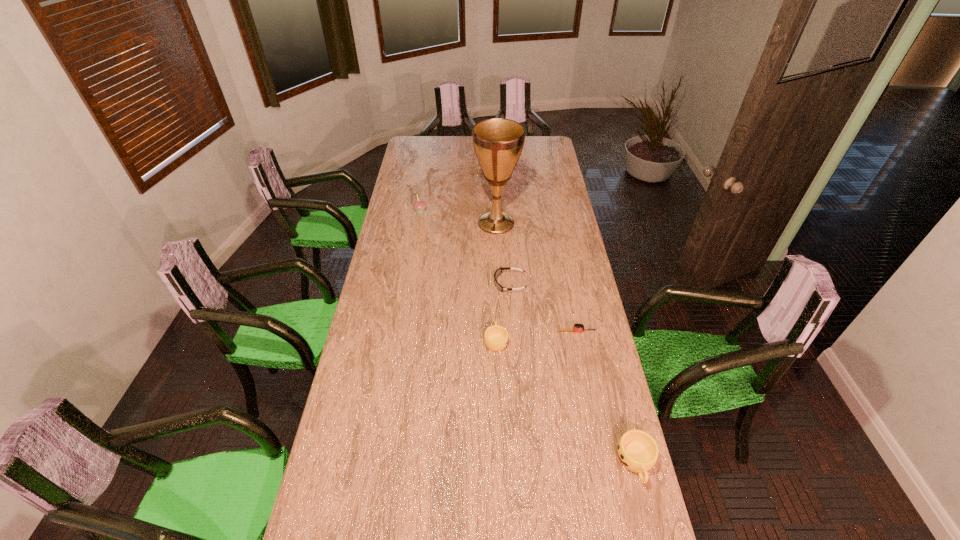
Considering the uniform spacing of cups, where should an additional cup be positioned on the left? Please locate a free spot. Please provide its 2D coordinates. Your answer should be formatted as a tuple, i.e. [(x, y)], where the tuple contains the x and y coordinates of a point satisfying the conditions above.

[(402, 259)]